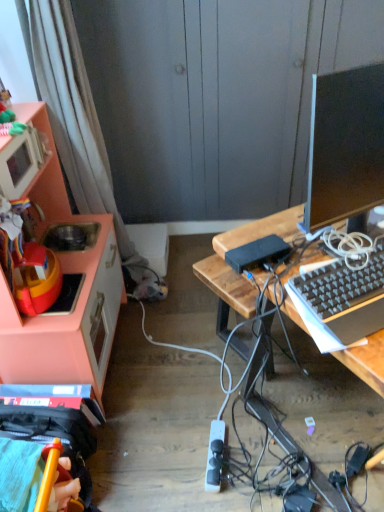
Question: Can you confirm if black plastic keyboard at right is bigger than white plastic power outlet at lower center?

Choices:
 (A) yes
 (B) no

Answer: (A)

Question: Does black plastic keyboard at right have a greater width compared to white plastic power outlet at lower center?

Choices:
 (A) yes
 (B) no

Answer: (B)

Question: Could you tell me if black plastic keyboard at right is turned towards white plastic power outlet at lower center?

Choices:
 (A) no
 (B) yes

Answer: (A)

Question: Is black plastic keyboard at right behind white plastic power outlet at lower center?

Choices:
 (A) yes
 (B) no

Answer: (B)

Question: Is black plastic keyboard at right facing away from white plastic power outlet at lower center?

Choices:
 (A) no
 (B) yes

Answer: (A)

Question: Is point (274, 226) positioned closer to the camera than point (324, 133)?

Choices:
 (A) closer
 (B) farther

Answer: (B)

Question: From a real-world perspective, is wooden desk at center above or below black glossy monitor at right?

Choices:
 (A) below
 (B) above

Answer: (A)

Question: Is wooden desk at center inside the boundaries of black glossy monitor at right, or outside?

Choices:
 (A) outside
 (B) inside

Answer: (A)

Question: Looking at their shapes, would you say wooden desk at center is wider or thinner than black glossy monitor at right?

Choices:
 (A) wide
 (B) thin

Answer: (A)

Question: Based on their sizes in the image, would you say white plastic power outlet at lower center is bigger or smaller than pink matte cabinet at left?

Choices:
 (A) small
 (B) big

Answer: (A)

Question: From the image's perspective, is white plastic power outlet at lower center positioned above or below pink matte cabinet at left?

Choices:
 (A) below
 (B) above

Answer: (A)

Question: Is white plastic power outlet at lower center situated inside pink matte cabinet at left or outside?

Choices:
 (A) outside
 (B) inside

Answer: (A)

Question: In terms of height, does white plastic power outlet at lower center look taller or shorter compared to pink matte cabinet at left?

Choices:
 (A) tall
 (B) short

Answer: (B)

Question: Based on their positions, is pink matte cabinet at left located to the left or right of wooden desk at center?

Choices:
 (A) right
 (B) left

Answer: (B)

Question: From a real-world perspective, is pink matte cabinet at left physically located above or below wooden desk at center?

Choices:
 (A) above
 (B) below

Answer: (A)